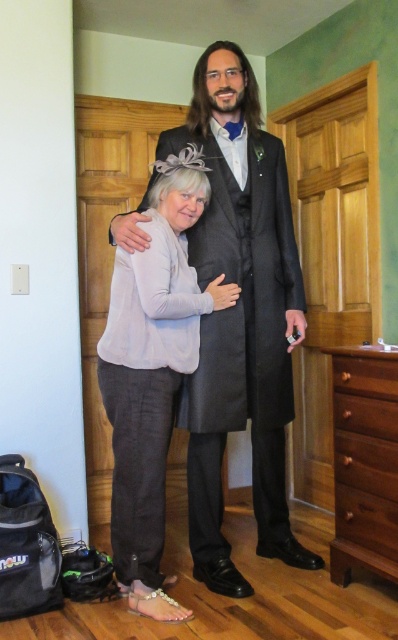
Is matte black suit at center to the left of light gray linen blouse at center from the viewer's perspective?

In fact, matte black suit at center is to the right of light gray linen blouse at center.

Image resolution: width=398 pixels, height=640 pixels. What are the coordinates of `matte black suit at center` in the screenshot? It's located at (239, 317).

Is point (269, 392) positioned after point (183, 291)?

Yes, point (269, 392) is farther from viewer.

The width and height of the screenshot is (398, 640). In order to click on matte black suit at center in this screenshot , I will do `click(239, 317)`.

Describe the element at coordinates (364, 461) in the screenshot. I see `brown wood dresser at lower right` at that location.

Does brown wood dresser at lower right have a smaller size compared to brown wood drawer at lower right?

No, brown wood dresser at lower right is not smaller than brown wood drawer at lower right.

Between point (368, 385) and point (366, 371), which one is positioned behind?

The point (366, 371) is behind.

Identify the location of brown wood dresser at lower right. (364, 461).

Does matte black suit at center have a larger size compared to brown wood dresser at lower right?

Yes, matte black suit at center is bigger than brown wood dresser at lower right.

Is the position of matte black suit at center less distant than that of brown wood dresser at lower right?

Yes, matte black suit at center is in front of brown wood dresser at lower right.

You are a GUI agent. You are given a task and a screenshot of the screen. Output one action in this format:
    pyautogui.click(x=<x>, y=<y>)
    Task: Click on the matte black suit at center
    Image resolution: width=398 pixels, height=640 pixels.
    Given the screenshot: What is the action you would take?
    pyautogui.click(x=239, y=317)